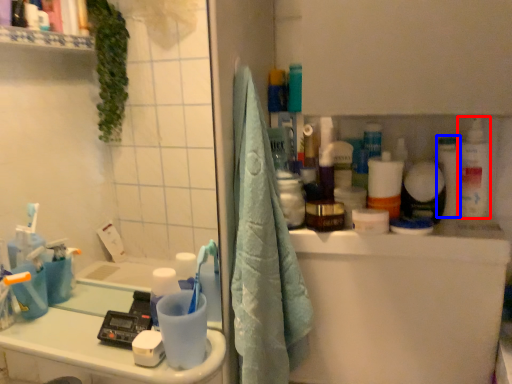
Question: Among these objects, which one is nearest to the camera, cleaning product (highlighted by a red box) or toiletry (highlighted by a blue box)?

Choices:
 (A) cleaning product
 (B) toiletry

Answer: (A)